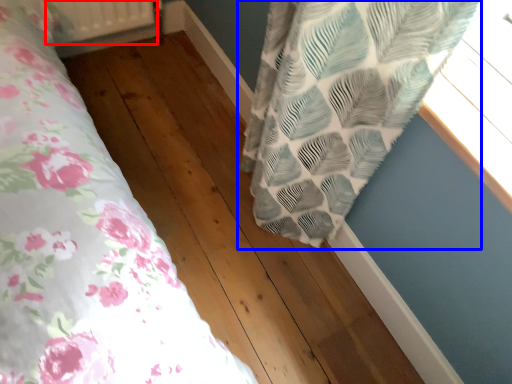
Question: Among these objects, which one is nearest to the camera, radiator (highlighted by a red box) or curtain (highlighted by a blue box)?

Choices:
 (A) radiator
 (B) curtain

Answer: (B)